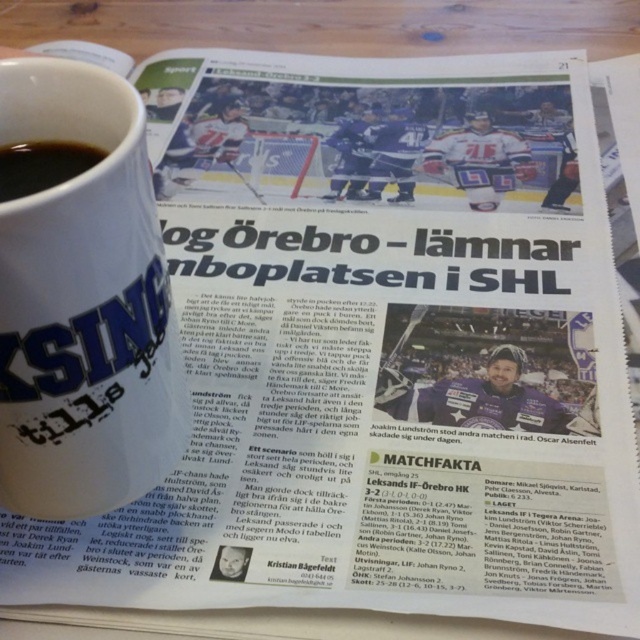
Question: Which point is closer to the camera taking this photo?

Choices:
 (A) (19, 156)
 (B) (12, 337)

Answer: (B)

Question: Can you confirm if white matte mug at upper left is positioned above black matte cup at upper left?

Choices:
 (A) no
 (B) yes

Answer: (A)

Question: Can you confirm if white matte mug at upper left is smaller than black matte cup at upper left?

Choices:
 (A) yes
 (B) no

Answer: (B)

Question: Is the position of white matte mug at upper left less distant than that of black matte cup at upper left?

Choices:
 (A) yes
 (B) no

Answer: (A)